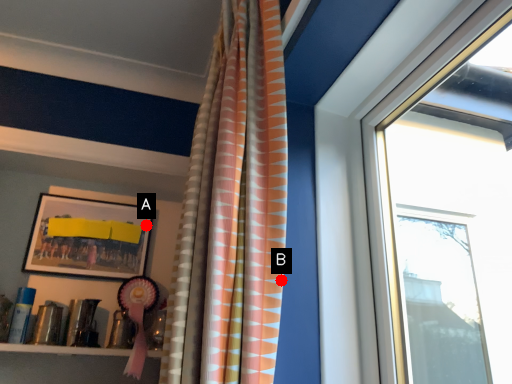
Question: Two points are circled on the image, labeled by A and B beside each circle. Which point is farther from the camera taking this photo?

Choices:
 (A) A is further
 (B) B is further

Answer: (A)